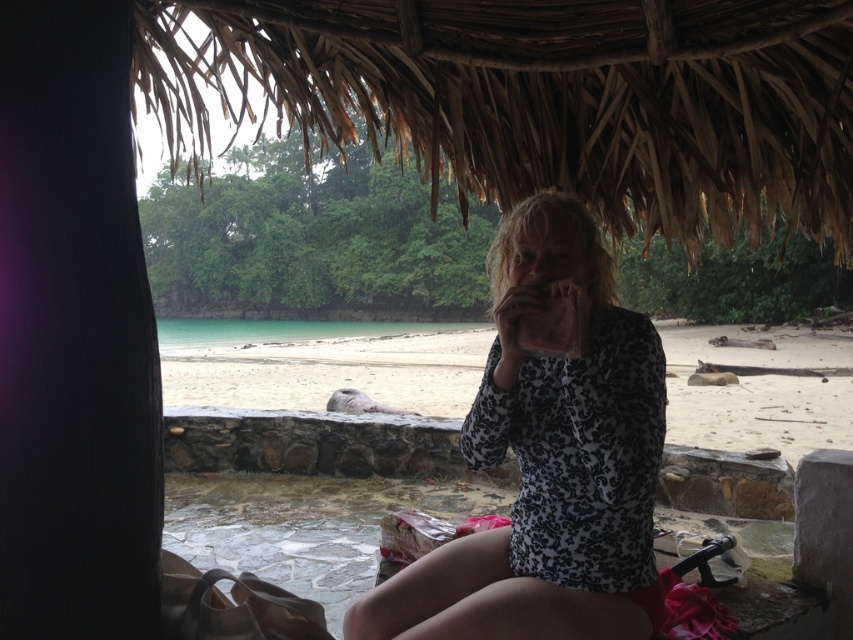
Question: Does white leopard print dress at center appear on the left side of beige sand at center?

Choices:
 (A) no
 (B) yes

Answer: (A)

Question: Which of the following is the farthest from the observer?

Choices:
 (A) beige sand at center
 (B) white leopard print dress at center

Answer: (A)

Question: From the image, what is the correct spatial relationship of white leopard print dress at center in relation to beige sand at center?

Choices:
 (A) above
 (B) below

Answer: (A)

Question: Which of the following is the farthest from the observer?

Choices:
 (A) beige sand at center
 (B) white leopard print dress at center

Answer: (A)

Question: Is white leopard print dress at center to the right of beige sand at center from the viewer's perspective?

Choices:
 (A) no
 (B) yes

Answer: (B)